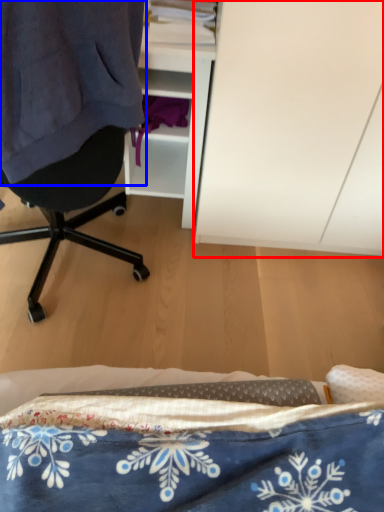
Question: Among these objects, which one is nearest to the camera, cabinetry (highlighted by a red box) or clothing (highlighted by a blue box)?

Choices:
 (A) cabinetry
 (B) clothing

Answer: (B)